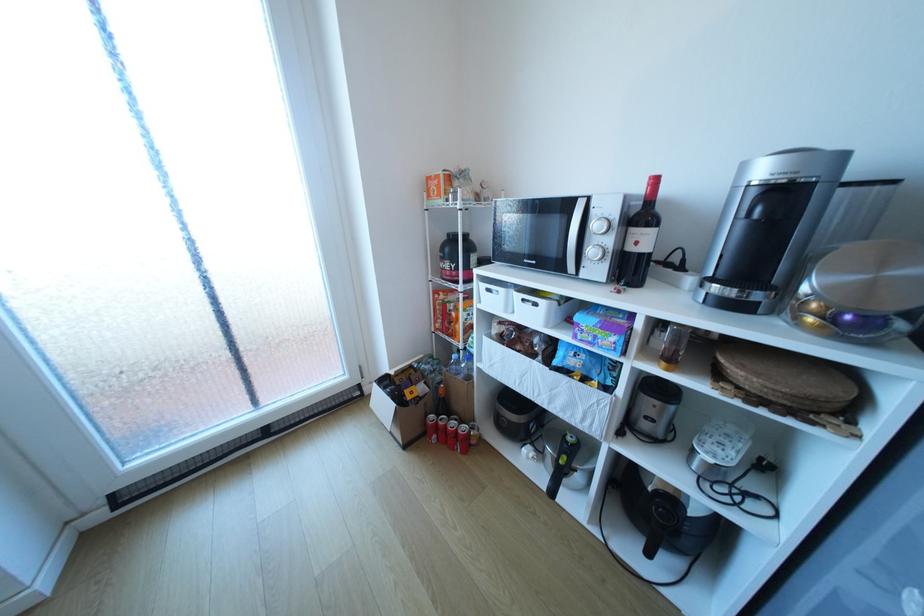
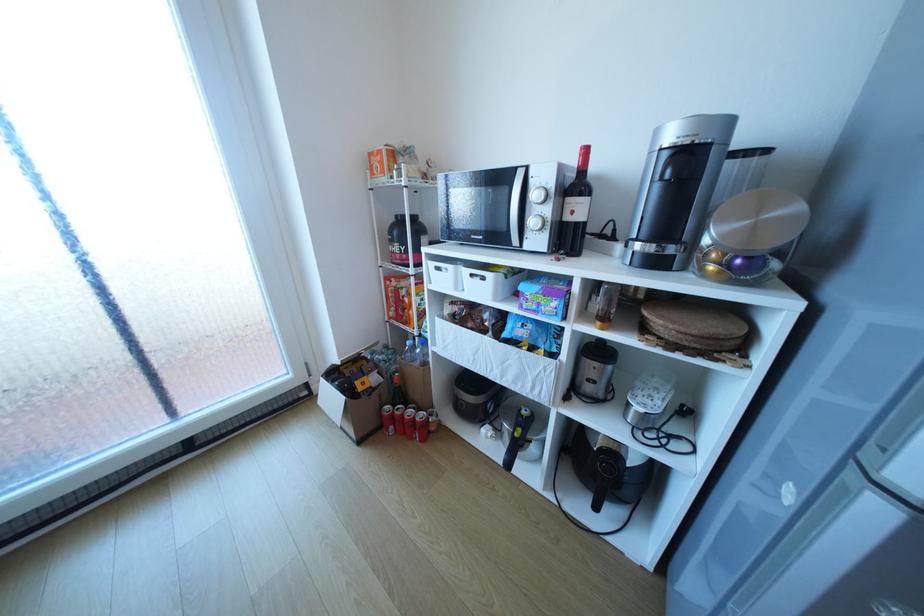
Find the pixel in the second image that matches (x=603, y=225) in the first image.

(542, 195)